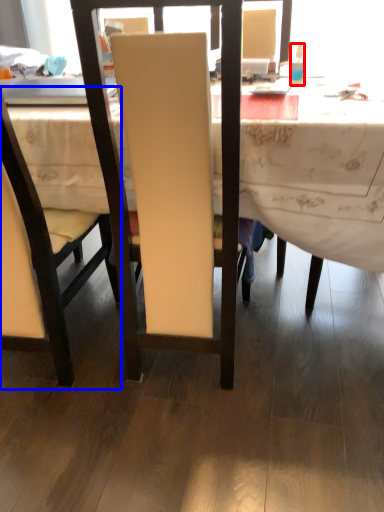
Question: Among these objects, which one is nearest to the camera, bottle (highlighted by a red box) or chair (highlighted by a blue box)?

Choices:
 (A) bottle
 (B) chair

Answer: (B)